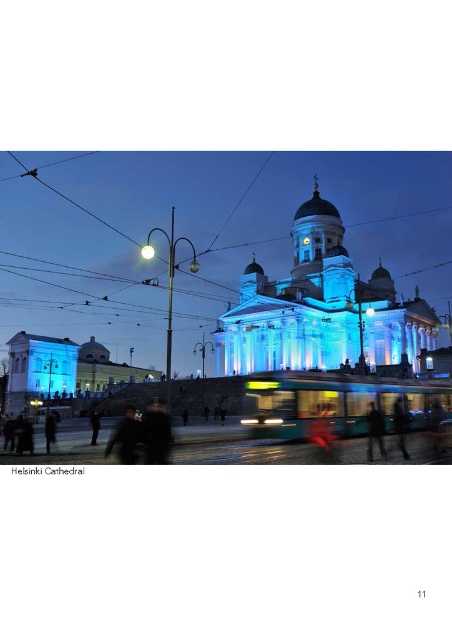
You are a tourist standing at the Helsinki Cathedral and want to take a photo that includes both the light blue stone church at center and the tram in motion. Where should you position yourself to ensure both are in the frame?

To include both the light blue stone church at center and the tram in motion, position yourself at a vantage point that captures the church at its central location and the tram along the street nearby. Since the church is at coordinates approximately 0.483 on the x and 0.710 on the y, align your camera to include the church centrally while framing the tram along the street in the foreground or background depending on its movement direction.

You are a tourist standing in front of the illuminated stone cathedral at center and the light blue stone church at center. Which one is more to the left?

The illuminated stone cathedral at center is more to the left side of the light blue stone church at center.